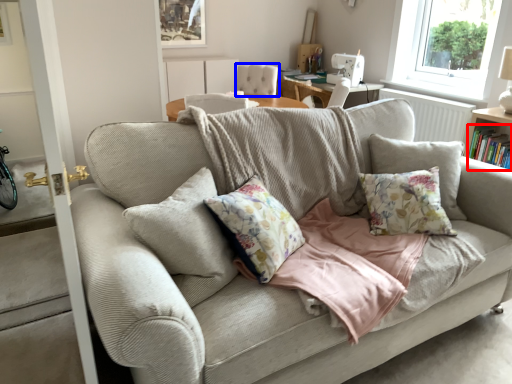
Question: Which of the following is the closest to the observer, book (highlighted by a red box) or armchair (highlighted by a blue box)?

Choices:
 (A) book
 (B) armchair

Answer: (A)